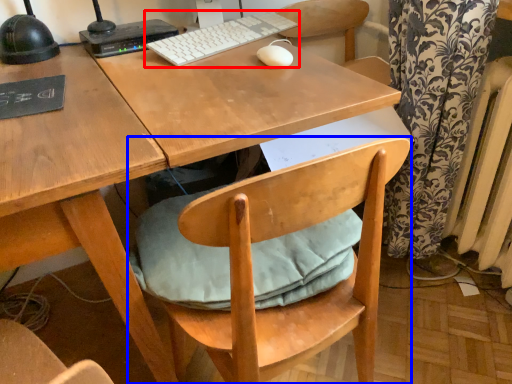
Question: Which point is further to the camera, computer keyboard (highlighted by a red box) or chair (highlighted by a blue box)?

Choices:
 (A) computer keyboard
 (B) chair

Answer: (A)